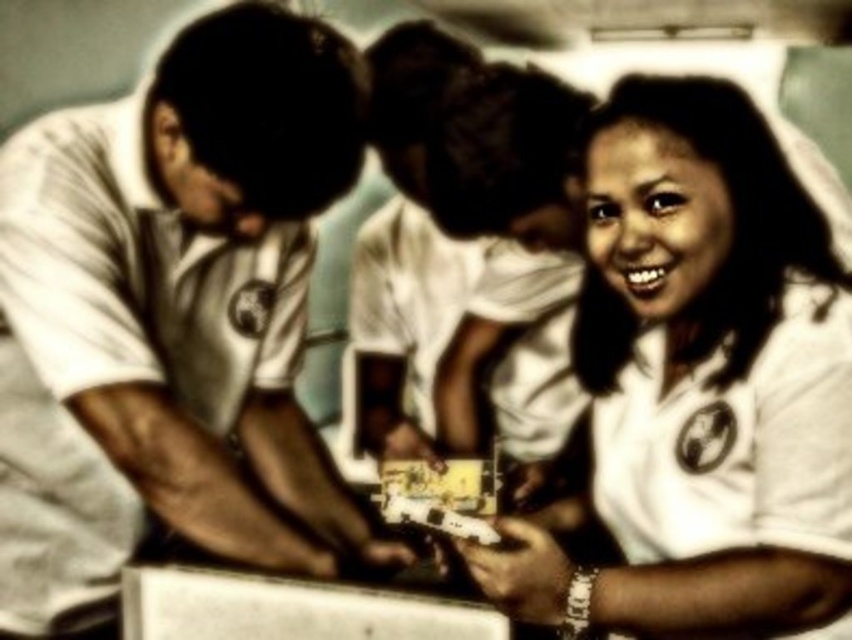
You are standing in the scene and want to hand a gift to the person wearing the white matte shirt at left. Based on their position, which direction should you walk to reach them?

The white matte shirt at left is located at point [194,280], so you should walk towards the left side of the frame to reach them.

What object is located at the coordinates point (x=194, y=280)?

The point (x=194, y=280) corresponds to the white matte shirt at left.